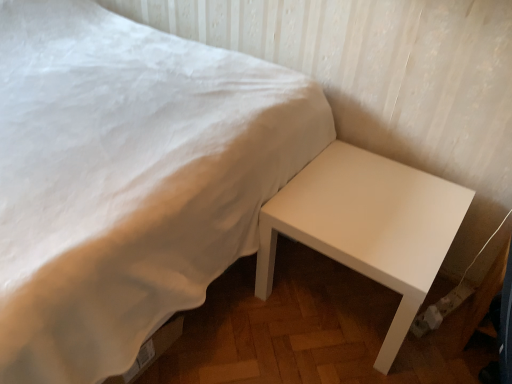
Question: Would you say white matte bed at lower right is a long distance from white glossy table at lower right?

Choices:
 (A) no
 (B) yes

Answer: (A)

Question: Does white matte bed at lower right touch white glossy table at lower right?

Choices:
 (A) yes
 (B) no

Answer: (B)

Question: Does white matte bed at lower right have a larger size compared to white glossy table at lower right?

Choices:
 (A) yes
 (B) no

Answer: (A)

Question: Can you confirm if white matte bed at lower right is smaller than white glossy table at lower right?

Choices:
 (A) no
 (B) yes

Answer: (A)

Question: Is white matte bed at lower right shorter than white glossy table at lower right?

Choices:
 (A) no
 (B) yes

Answer: (A)

Question: From a real-world perspective, does white matte bed at lower right sit lower than white glossy table at lower right?

Choices:
 (A) yes
 (B) no

Answer: (B)

Question: Is white glossy table at lower right bigger than white matte bed at lower right?

Choices:
 (A) yes
 (B) no

Answer: (B)

Question: From the image's perspective, is white glossy table at lower right beneath white matte bed at lower right?

Choices:
 (A) yes
 (B) no

Answer: (A)

Question: Is white glossy table at lower right shorter than white matte bed at lower right?

Choices:
 (A) no
 (B) yes

Answer: (B)

Question: Is white glossy table at lower right turned away from white matte bed at lower right?

Choices:
 (A) no
 (B) yes

Answer: (A)

Question: Would you say white glossy table at lower right is outside white matte bed at lower right?

Choices:
 (A) yes
 (B) no

Answer: (A)

Question: Considering the relative sizes of white glossy table at lower right and white matte bed at lower right in the image provided, is white glossy table at lower right smaller than white matte bed at lower right?

Choices:
 (A) yes
 (B) no

Answer: (A)

Question: Is point (372, 210) closer or farther from the camera than point (154, 266)?

Choices:
 (A) closer
 (B) farther

Answer: (B)